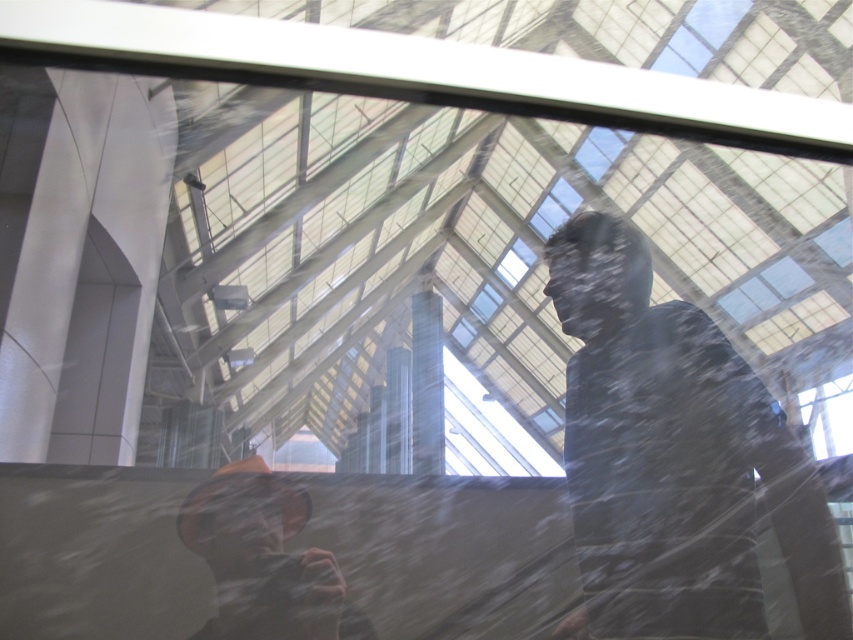
From the picture: Between matte black jacket at right and transparent glass window at upper center, which one has less height?

Standing shorter between the two is matte black jacket at right.

Is point (682, 451) positioned behind point (621, 140)?

No.

Between point (641, 490) and point (602, 150), which one is positioned behind?

The point (602, 150) is behind.

You are a GUI agent. You are given a task and a screenshot of the screen. Output one action in this format:
    pyautogui.click(x=<x>, y=<y>)
    Task: Click on the matte black jacket at right
    
    Given the screenshot: What is the action you would take?
    pyautogui.click(x=675, y=460)

What do you see at coordinates (675, 460) in the screenshot? The width and height of the screenshot is (853, 640). I see `matte black jacket at right` at bounding box center [675, 460].

Is matte black jacket at right to the right of orange fabric hat at lower left from the viewer's perspective?

Indeed, matte black jacket at right is positioned on the right side of orange fabric hat at lower left.

Locate an element on the screen. Image resolution: width=853 pixels, height=640 pixels. matte black jacket at right is located at coordinates (675, 460).

At what (x,y) coordinates should I click in order to perform the action: click on matte black jacket at right. Please return your answer as a coordinate pair (x, y). The height and width of the screenshot is (640, 853). Looking at the image, I should click on (675, 460).

Between point (242, 483) and point (607, 163), which one is positioned behind?

The point (607, 163) is behind.

Between orange fabric hat at lower left and transparent glass window at upper center, which one has more height?

transparent glass window at upper center is taller.

Does point (242, 572) lie in front of point (585, 154)?

Yes, it is.

This screenshot has width=853, height=640. Find the location of `orange fabric hat at lower left`. orange fabric hat at lower left is located at coordinates (260, 557).